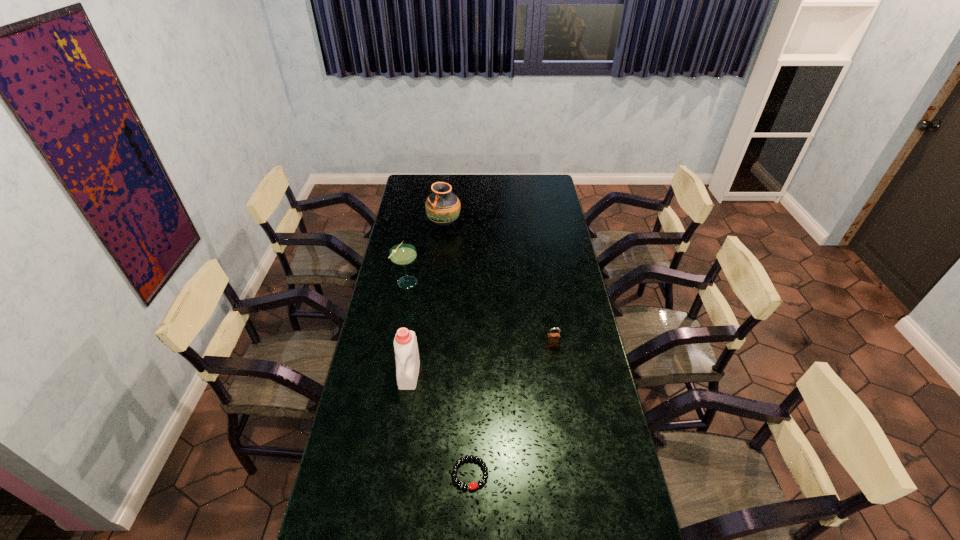
Find the location of a particular element. This screenshot has height=540, width=960. the farthest object is located at coordinates (442, 207).

Find the location of a particular element. Image resolution: width=960 pixels, height=540 pixels. detergent is located at coordinates (405, 343).

Find the location of `martini`. martini is located at coordinates (402, 254).

You are a GUI agent. You are given a task and a screenshot of the screen. Output one action in this format:
    pyautogui.click(x=<x>, y=<y>)
    Task: Click on the third shortest object
    This screenshot has width=960, height=540.
    Given the screenshot: What is the action you would take?
    pyautogui.click(x=402, y=254)

I want to click on the fourth tallest object, so click(x=553, y=339).

Identify the location of the third farthest object. This screenshot has height=540, width=960. (553, 339).

Where is `bracelet`? bracelet is located at coordinates (473, 485).

Image resolution: width=960 pixels, height=540 pixels. What are the coordinates of `the shortest object` in the screenshot? It's located at (473, 485).

Find the location of `vacant region located on the back of the pottery`. vacant region located on the back of the pottery is located at coordinates (446, 204).

Locate an element on the screen. vacant space situated 0.090m on the handle side of the detergent is located at coordinates (403, 414).